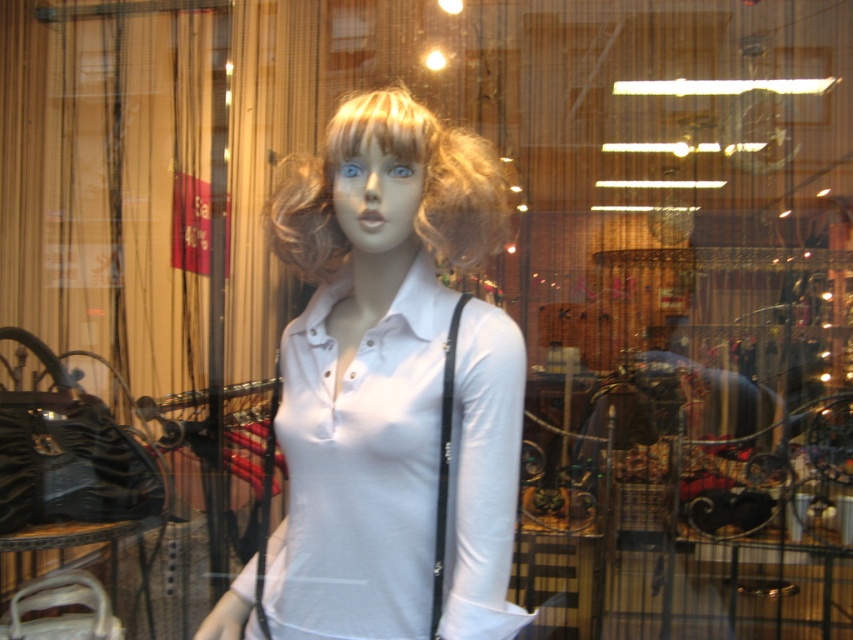
Question: Is white matte shirt at center smaller than blondehair at center?

Choices:
 (A) no
 (B) yes

Answer: (A)

Question: In this image, where is white matte shirt at center located relative to blondehair at center?

Choices:
 (A) right
 (B) left

Answer: (A)

Question: Which point is farther to the camera?

Choices:
 (A) white matte shirt at center
 (B) blondehair at center

Answer: (B)

Question: Considering the relative positions of white matte shirt at center and blondehair at center in the image provided, where is white matte shirt at center located with respect to blondehair at center?

Choices:
 (A) right
 (B) left

Answer: (A)